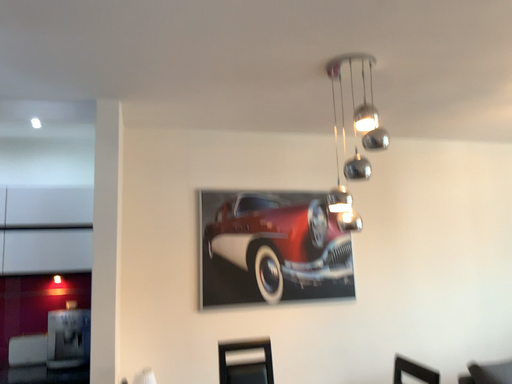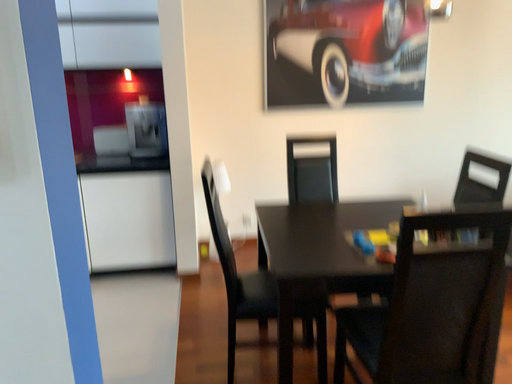
Question: Which way did the camera rotate in the video?

Choices:
 (A) rotated upward
 (B) rotated downward

Answer: (B)